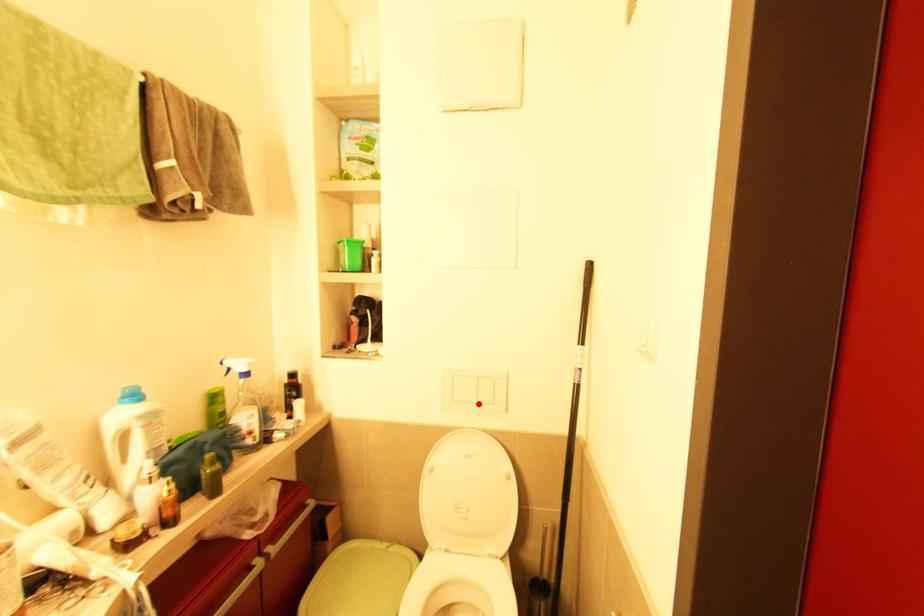
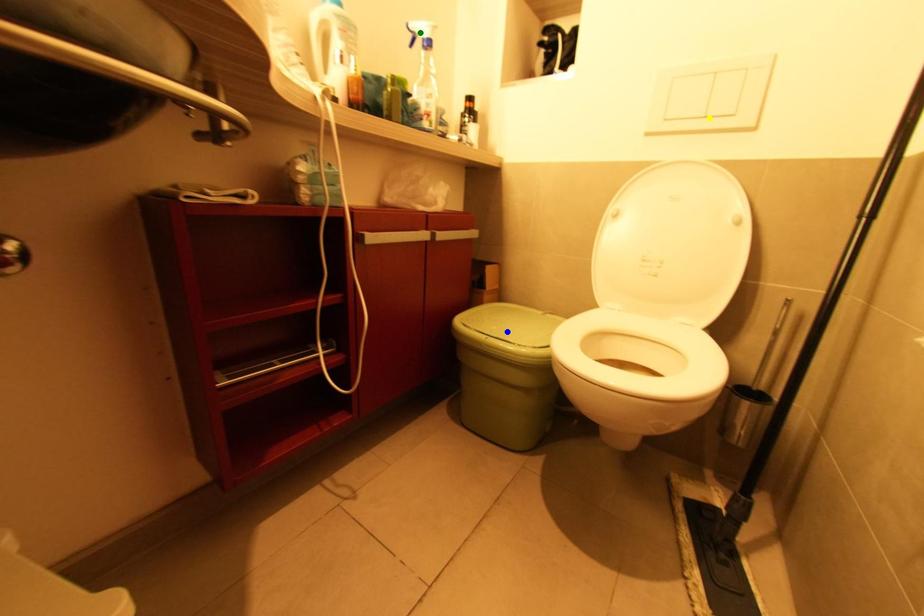
Question: I am providing you with two images of the same scene from different viewpoints. A red point is marked on the first image. You are given multiple points on the second image. Which spot in image 2 lines up with the point in image 1?

Choices:
 (A) blue point
 (B) yellow point
 (C) green point

Answer: (B)